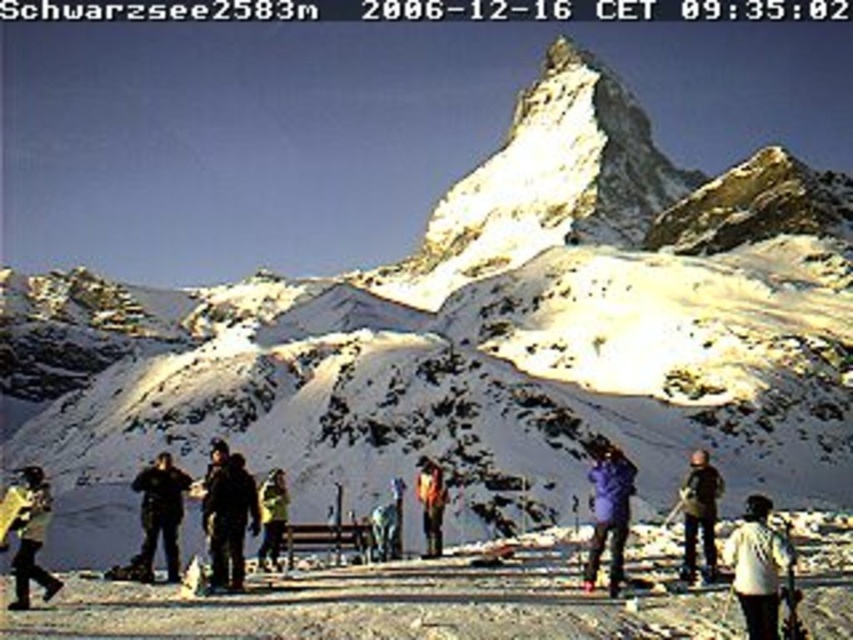
Question: Can you confirm if white matte jacket at lower right is positioned above orange fabric jacket at center?

Choices:
 (A) yes
 (B) no

Answer: (A)

Question: Does purple fabric jacket at center have a lesser width compared to dark brown jacket at center?

Choices:
 (A) no
 (B) yes

Answer: (B)

Question: Which object appears farthest from the camera in this image?

Choices:
 (A) yellow fabric jacket at center
 (B) dark gray jacket at center

Answer: (A)

Question: Does matte black jacket at lower left have a greater width compared to yellow fabric jacket at center?

Choices:
 (A) yes
 (B) no

Answer: (A)

Question: Which object is closer to the camera taking this photo?

Choices:
 (A) matte black jacket at lower left
 (B) white snow at center
 (C) orange fabric jacket at center
 (D) dark gray jacket at lower left

Answer: (B)

Question: Which point is closer to the camera?

Choices:
 (A) (231, 554)
 (B) (787, 566)
 (C) (718, 496)
 (D) (434, 522)

Answer: (B)